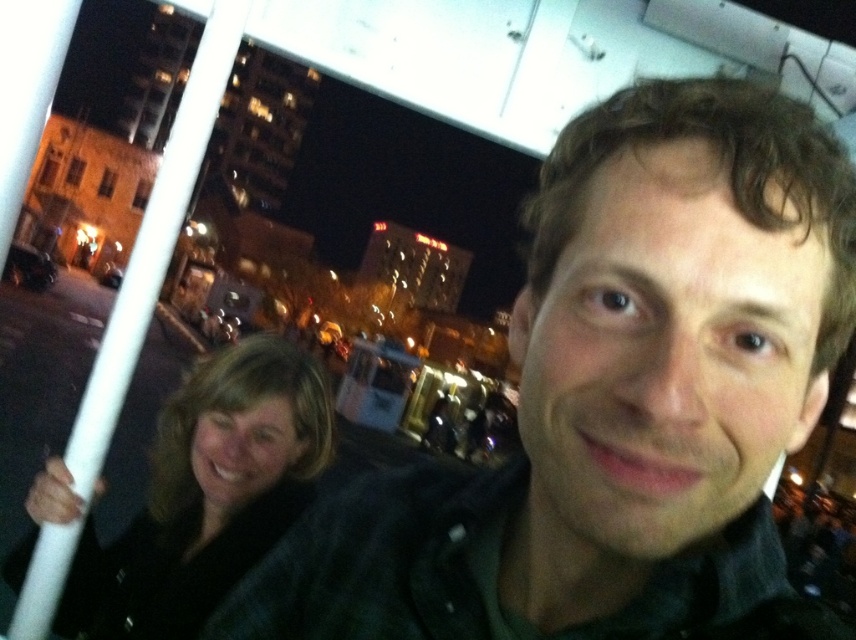
Question: Can you confirm if dark green shirt at center is smaller than dark brown hair at lower left?

Choices:
 (A) yes
 (B) no

Answer: (B)

Question: Does dark green shirt at center have a lesser width compared to dark brown hair at lower left?

Choices:
 (A) no
 (B) yes

Answer: (B)

Question: Which point is farther to the camera?

Choices:
 (A) dark brown hair at lower left
 (B) dark green shirt at center

Answer: (A)

Question: Is dark green shirt at center further to camera compared to dark brown hair at lower left?

Choices:
 (A) no
 (B) yes

Answer: (A)